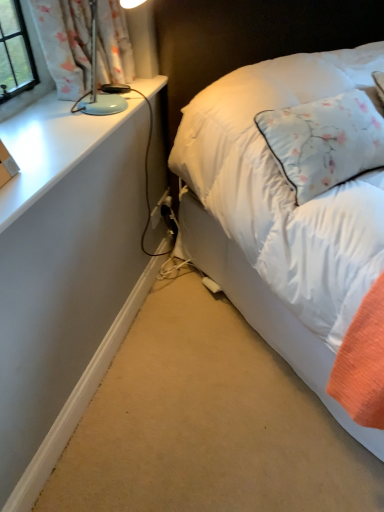
Question: Is matte blue lamp at upper left beside white soft bed at right?

Choices:
 (A) yes
 (B) no

Answer: (B)

Question: Is matte blue lamp at upper left aimed at white soft bed at right?

Choices:
 (A) no
 (B) yes

Answer: (B)

Question: From a real-world perspective, is matte blue lamp at upper left located beneath white soft bed at right?

Choices:
 (A) yes
 (B) no

Answer: (B)

Question: Is matte blue lamp at upper left positioned far away from white soft bed at right?

Choices:
 (A) no
 (B) yes

Answer: (A)

Question: Is matte blue lamp at upper left thinner than white soft bed at right?

Choices:
 (A) no
 (B) yes

Answer: (B)

Question: In terms of width, does matte blue lamp at upper left look wider or thinner when compared to white soft bed at right?

Choices:
 (A) thin
 (B) wide

Answer: (A)

Question: Does point (29, 202) appear closer or farther from the camera than point (195, 234)?

Choices:
 (A) closer
 (B) farther

Answer: (A)

Question: Which is correct: matte blue lamp at upper left is inside white soft bed at right, or outside of it?

Choices:
 (A) outside
 (B) inside

Answer: (A)

Question: In the image, is matte blue lamp at upper left positioned in front of or behind white soft bed at right?

Choices:
 (A) front
 (B) behind

Answer: (B)

Question: Considering the positions of white matte desk at lower left and matte blue lamp at upper left in the image, is white matte desk at lower left taller or shorter than matte blue lamp at upper left?

Choices:
 (A) tall
 (B) short

Answer: (A)

Question: In the image, is white matte desk at lower left on the left side or the right side of matte blue lamp at upper left?

Choices:
 (A) right
 (B) left

Answer: (A)

Question: From the image's perspective, is white matte desk at lower left above or below matte blue lamp at upper left?

Choices:
 (A) below
 (B) above

Answer: (A)

Question: Is white matte desk at lower left inside or outside of matte blue lamp at upper left?

Choices:
 (A) outside
 (B) inside

Answer: (A)

Question: From the image's perspective, is white matte desk at lower left positioned above or below white soft bed at right?

Choices:
 (A) above
 (B) below

Answer: (B)

Question: Choose the correct answer: Is white matte desk at lower left inside white soft bed at right or outside it?

Choices:
 (A) outside
 (B) inside

Answer: (A)